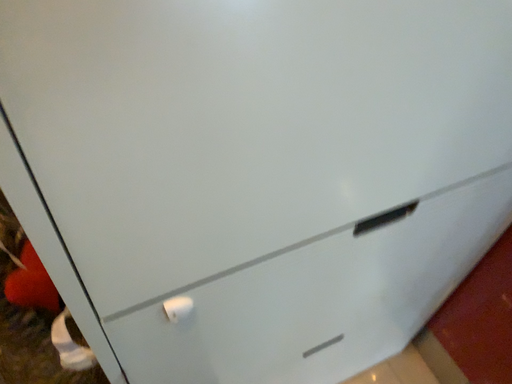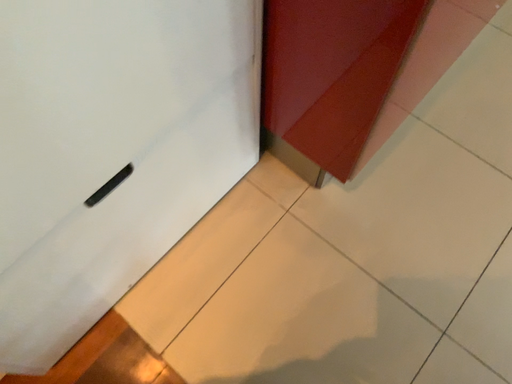
Question: How did the camera likely rotate when shooting the video?

Choices:
 (A) rotated downward
 (B) rotated upward

Answer: (A)